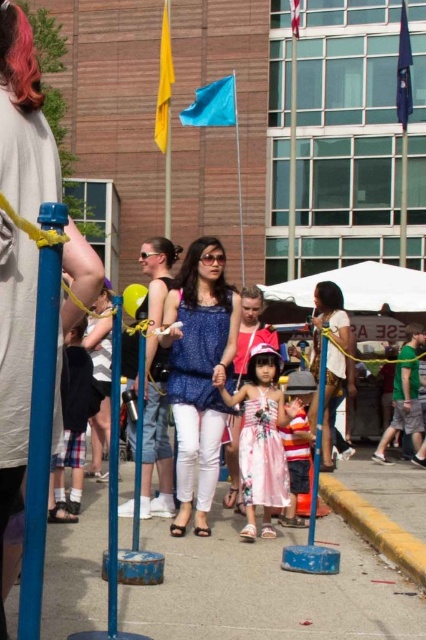
Question: Which of the following is the farthest from the observer?

Choices:
 (A) (172, 362)
 (B) (282, 449)
 (C) (313, 422)
 (D) (111, 422)

Answer: (C)

Question: Does blue textured blouse at center have a greater width compared to striped cotton shirt at center?

Choices:
 (A) no
 (B) yes

Answer: (B)

Question: Does matte blue dress at center have a greater width compared to floral cotton dress at center?

Choices:
 (A) no
 (B) yes

Answer: (A)

Question: Does floral cotton dress at center appear on the left side of striped cotton shirt at center?

Choices:
 (A) yes
 (B) no

Answer: (A)

Question: Which object is farther from the camera taking this photo?

Choices:
 (A) floral cotton dress at center
 (B) blue painted metal pole at center
 (C) smooth concrete pavement at center
 (D) blue textured blouse at center

Answer: (A)

Question: Considering the real-world distances, which object is closest to the striped cotton shirt at center?

Choices:
 (A) smooth concrete pavement at center
 (B) floral cotton dress at center
 (C) blue textured blouse at center

Answer: (B)